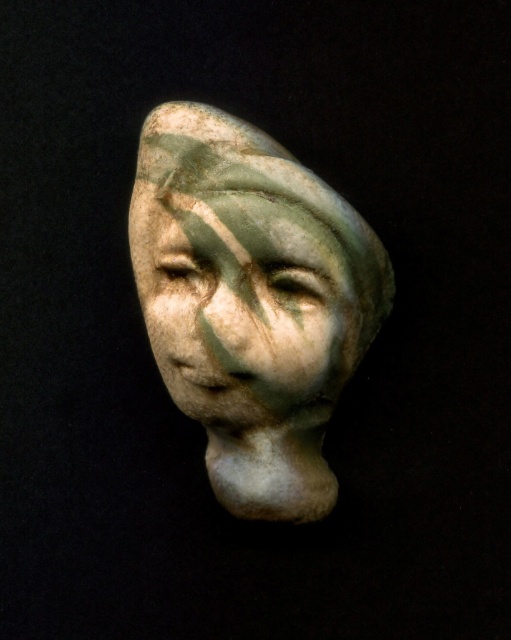
You are standing in front of the sculpture and want to touch the point at coordinates point (328,353). If your arm can reach 1.2 meters, can you reach it?

The point (328,353) is 1.32 meters away from the camera, so your arm can not reach it since it is 0.12 meters too far.

You are an art conservator examining two sculptures in the image. You need to determine which one is taller between the green marble head at center and the matte green stone face at center. Which sculpture is taller?

The green marble head at center is taller than the matte green stone face at center according to the description.

You are an archaeologist examining the ancient ceramic head sculpture. You notice two points on the sculpture marked at coordinates point (296, 168) and point (283, 216). Which point is closer to you?

Point (296, 168) is further to the viewer than point (283, 216), so the point closer to you is point (283, 216).